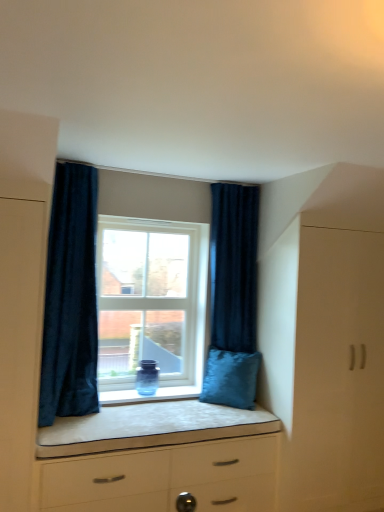
What do you see at coordinates (234, 267) in the screenshot? The width and height of the screenshot is (384, 512). I see `dark blue velvet curtain at right, the 1th curtain positioned from the right` at bounding box center [234, 267].

This screenshot has height=512, width=384. What do you see at coordinates (151, 301) in the screenshot?
I see `clear glass window at center` at bounding box center [151, 301].

Find the location of a particular element. white matte cabinet at right is located at coordinates (325, 359).

Describe the element at coordinates (325, 359) in the screenshot. Image resolution: width=384 pixels, height=512 pixels. I see `white matte cabinet at right` at that location.

The height and width of the screenshot is (512, 384). In order to click on dark blue velvet curtain at right, which is the second curtain from front to back in this screenshot , I will do click(234, 267).

Considering the sizes of dark blue velvet curtain at right, acting as the first curtain starting from the back, and white glossy chest of drawers at center in the image, is dark blue velvet curtain at right, acting as the first curtain starting from the back, taller or shorter than white glossy chest of drawers at center?

dark blue velvet curtain at right, acting as the first curtain starting from the back, is taller than white glossy chest of drawers at center.

Does dark blue velvet curtain at right, acting as the first curtain starting from the back, have a larger size compared to white glossy chest of drawers at center?

Incorrect, dark blue velvet curtain at right, acting as the first curtain starting from the back, is not larger than white glossy chest of drawers at center.

Is dark blue velvet curtain at right, the second curtain from the left, oriented away from white glossy chest of drawers at center?

No.

Based on their sizes in the image, would you say white glossy chest of drawers at center is bigger or smaller than dark blue velvet curtain at left, which is the first curtain from left to right?

Clearly, white glossy chest of drawers at center is larger in size than dark blue velvet curtain at left, which is the first curtain from left to right.

In terms of height, does white glossy chest of drawers at center look taller or shorter compared to dark blue velvet curtain at left, which is the 2th curtain in back-to-front order?

In the image, white glossy chest of drawers at center appears to be shorter than dark blue velvet curtain at left, which is the 2th curtain in back-to-front order.

From the image's perspective, is white glossy chest of drawers at center under dark blue velvet curtain at left, marked as the first curtain in a front-to-back arrangement?

Indeed, from the image's perspective, white glossy chest of drawers at center is shown beneath dark blue velvet curtain at left, marked as the first curtain in a front-to-back arrangement.

Considering the points (234, 502) and (69, 216), which point is behind, point (234, 502) or point (69, 216)?

The point (234, 502) is behind.

Which object is more forward, dark blue velvet curtain at right, which is the second curtain from front to back, or dark blue velvet curtain at left, which is the first curtain from left to right?

dark blue velvet curtain at left, which is the first curtain from left to right.

Looking at this image, from the image's perspective, does dark blue velvet curtain at right, the second curtain from the left, appear lower than dark blue velvet curtain at left, marked as the first curtain in a front-to-back arrangement?

Correct, dark blue velvet curtain at right, the second curtain from the left, appears lower than dark blue velvet curtain at left, marked as the first curtain in a front-to-back arrangement, in the image.

Does dark blue velvet curtain at right, which is the second curtain from front to back, have a lesser height compared to dark blue velvet curtain at left, which is the 2th curtain in back-to-front order?

Yes.

Which of these two, white glossy chest of drawers at center or white matte cabinet at right, is wider?

Wider between the two is white glossy chest of drawers at center.

Between white glossy chest of drawers at center and white matte cabinet at right, which one is positioned behind?

white matte cabinet at right is further from the camera.

At what (x,y) coordinates should I click in order to perform the action: click on chest of drawers that appears on the left of white matte cabinet at right. Please return your answer as a coordinate pair (x, y). This screenshot has width=384, height=512. Looking at the image, I should click on [x=159, y=460].

Considering the sizes of objects clear glass window at center and white matte cabinet at right in the image provided, who is thinner, clear glass window at center or white matte cabinet at right?

Thinner between the two is clear glass window at center.

What's the angular difference between clear glass window at center and white matte cabinet at right's facing directions?

0.000733 degrees separate the facing orientations of clear glass window at center and white matte cabinet at right.

Is clear glass window at center situated inside white matte cabinet at right or outside?

clear glass window at center is not inside white matte cabinet at right, it's outside.

From a real-world perspective, between clear glass window at center and white matte cabinet at right, who is vertically higher?

clear glass window at center.

Is point (232, 371) closer to viewer compared to point (175, 504)?

No, it is not.

Does velvet blue pillow at lower right turn towards white glossy chest of drawers at center?

No, velvet blue pillow at lower right is not facing towards white glossy chest of drawers at center.

From the picture: From the image's perspective, would you say velvet blue pillow at lower right is shown under white glossy chest of drawers at center?

No.

From a real-world perspective, which is physically above, velvet blue pillow at lower right or white glossy chest of drawers at center?

In real-world perspective, velvet blue pillow at lower right is above.

From the image's perspective, would you say velvet blue pillow at lower right is positioned over clear glass window at center?

Incorrect, from the image's perspective, velvet blue pillow at lower right is lower than clear glass window at center.

Is velvet blue pillow at lower right oriented away from clear glass window at center?

No, velvet blue pillow at lower right is not facing away from clear glass window at center.

From a real-world perspective, is velvet blue pillow at lower right positioned above or below clear glass window at center?

velvet blue pillow at lower right is situated lower than clear glass window at center in the real world.

Considering the positions of objects velvet blue pillow at lower right and clear glass window at center in the image provided, who is more to the left, velvet blue pillow at lower right or clear glass window at center?

Positioned to the left is clear glass window at center.

Find the location of a particular element. This screenshot has height=512, width=384. curtain on the right of the white glossy chest of drawers at center is located at coordinates (234, 267).

Where is `curtain that is the 2nd object located above the white glossy chest of drawers at center (from the image's perspective)`? The image size is (384, 512). curtain that is the 2nd object located above the white glossy chest of drawers at center (from the image's perspective) is located at coordinates (70, 298).

Looking at the image, which one is located further to dark blue velvet curtain at left, which is the first curtain from left to right, dark blue velvet curtain at right, the second curtain from the left, or velvet blue pillow at lower right?

Among the two, velvet blue pillow at lower right is located further to dark blue velvet curtain at left, which is the first curtain from left to right.

When comparing their distances from white matte cabinet at right, does clear glass window at center or dark blue velvet curtain at left, marked as the first curtain in a front-to-back arrangement, seem closer?

Based on the image, clear glass window at center appears to be nearer to white matte cabinet at right.

Estimate the real-world distances between objects in this image. Which object is further from white matte cabinet at right, white glossy chest of drawers at center or clear glass window at center?

clear glass window at center is further to white matte cabinet at right.

Considering their positions, is dark blue velvet curtain at left, marked as the first curtain in a front-to-back arrangement, positioned closer to velvet blue pillow at lower right than white glossy chest of drawers at center?

white glossy chest of drawers at center lies closer to velvet blue pillow at lower right than the other object.

Based on their spatial positions, is white glossy chest of drawers at center or velvet blue pillow at lower right further from dark blue velvet curtain at left, which is the 2th curtain in back-to-front order?

Among the two, velvet blue pillow at lower right is located further to dark blue velvet curtain at left, which is the 2th curtain in back-to-front order.

Looking at the image, which one is located further to clear glass window at center, velvet blue pillow at lower right or dark blue velvet curtain at left, marked as the first curtain in a front-to-back arrangement?

The object further to clear glass window at center is velvet blue pillow at lower right.

From the image, which object appears to be nearer to clear glass window at center, dark blue velvet curtain at left, marked as the first curtain in a front-to-back arrangement, or white matte cabinet at right?

dark blue velvet curtain at left, marked as the first curtain in a front-to-back arrangement, is closer to clear glass window at center.

From the picture: Considering their positions, is white glossy chest of drawers at center positioned further to dark blue velvet curtain at left, which is the first curtain from left to right, than clear glass window at center?

The object further to dark blue velvet curtain at left, which is the first curtain from left to right, is white glossy chest of drawers at center.

The image size is (384, 512). In order to click on chest of drawers between dark blue velvet curtain at left, which is the first curtain from left to right, and white matte cabinet at right from left to right in this screenshot , I will do `click(159, 460)`.

The height and width of the screenshot is (512, 384). Find the location of `curtain located between white glossy chest of drawers at center and white matte cabinet at right in the left-right direction`. curtain located between white glossy chest of drawers at center and white matte cabinet at right in the left-right direction is located at coordinates (234, 267).

Identify the location of pillow located between clear glass window at center and dark blue velvet curtain at right, the second curtain from the left, in the left-right direction. (230, 378).

Where is `curtain between velvet blue pillow at lower right and white matte cabinet at right in the horizontal direction`? The width and height of the screenshot is (384, 512). curtain between velvet blue pillow at lower right and white matte cabinet at right in the horizontal direction is located at coordinates (234, 267).